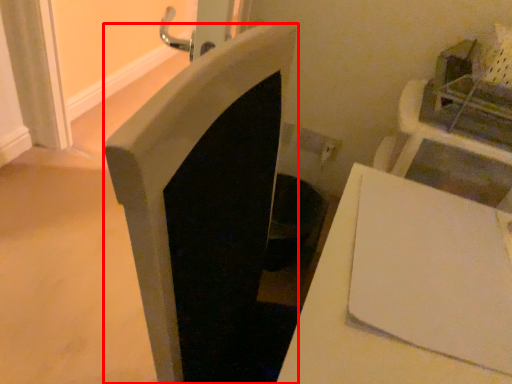
Question: From the image's perspective, where is fireplace (annotated by the red box) located in relation to table in the image?

Choices:
 (A) below
 (B) above

Answer: (B)